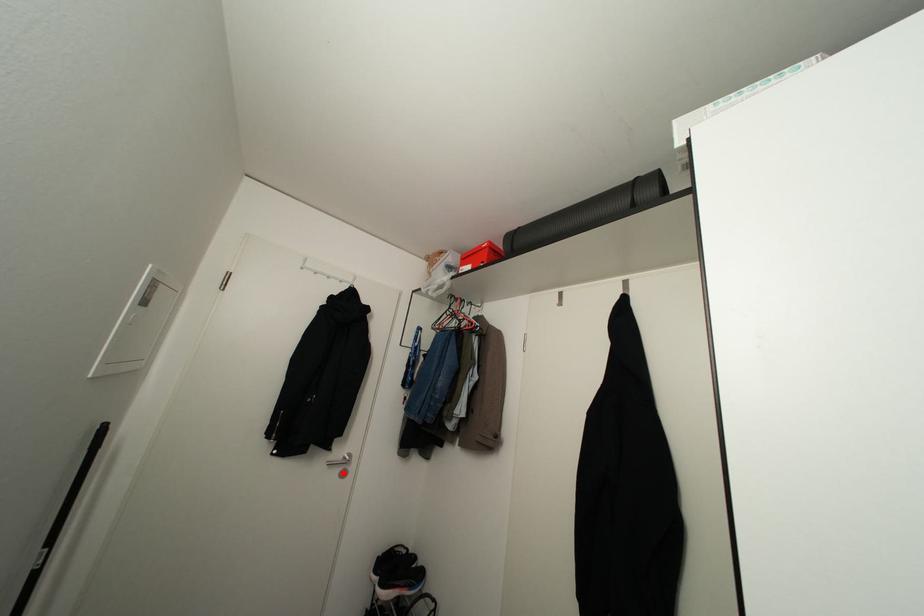
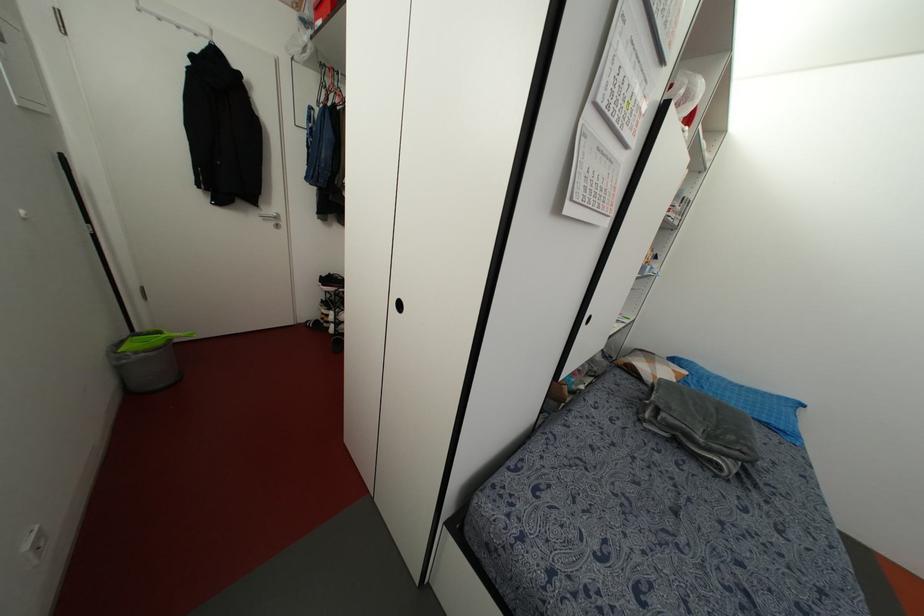
Question: I am providing you with two images of the same scene from different viewpoints. A red point is marked on the first image. Can you still see the location of the red point in image 2?

Choices:
 (A) Yes
 (B) No

Answer: (A)